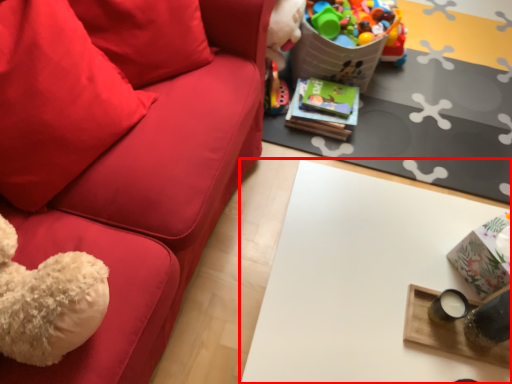
Question: In this image, where is table (annotated by the red box) located relative to pillow?

Choices:
 (A) right
 (B) left

Answer: (A)